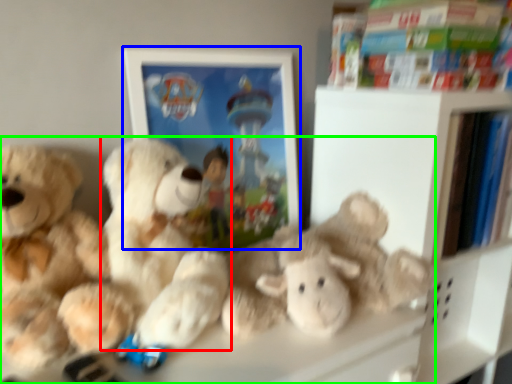
Question: Estimate the real-world distances between objects in this image. Which object is farther from teddy bear (highlighted by a red box), picture frame (highlighted by a blue box) or teddy bear (highlighted by a green box)?

Choices:
 (A) picture frame
 (B) teddy bear

Answer: (A)